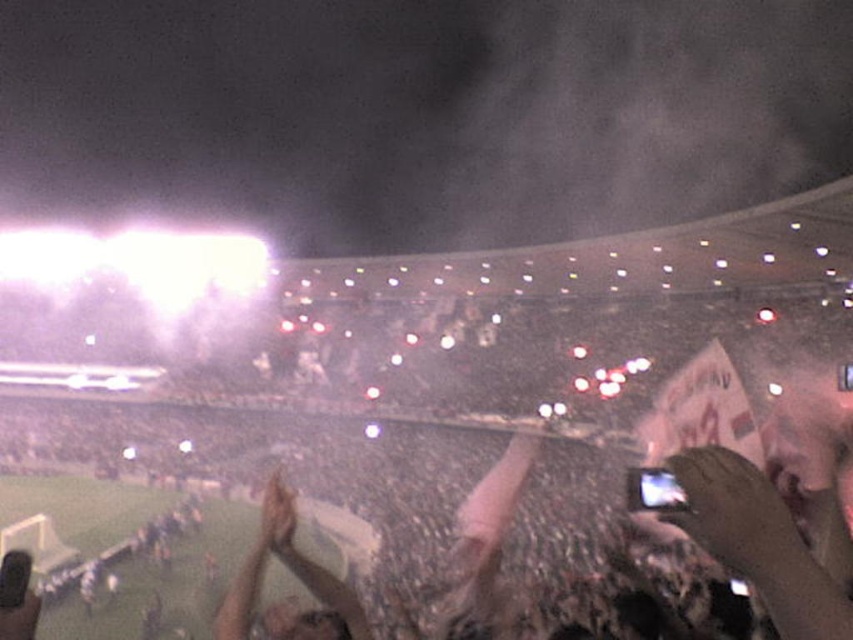
You are a photographer at the stadium and want to capture both the smooth brown leather hand at center and the smooth skin hand at center in a single shot. Which hand should you position to the right side of your camera frame to include both?

You should position the smooth skin hand at center to the right side of your camera frame because the smooth brown leather hand at center is already to the right of it, ensuring both are included in the shot.

You are standing at the point labeled point (337, 618) in the stadium. You want to move to the front of the crowd. Which direction should you move towards the point labeled point (715, 488)?

To move to the front of the crowd, you should move towards the point labeled point (715, 488) because it is in front of point (337, 618).

You are a photographer trying to capture the light brown leather jacket at center and the smooth skin hand at center in a single shot. However, your camera can only focus on one subject at a time. Which object should you focus on to ensure the other remains in the background?

You should focus on the light brown leather jacket at center because it is in front of the smooth skin hand at center, so the hand will naturally appear in the background.